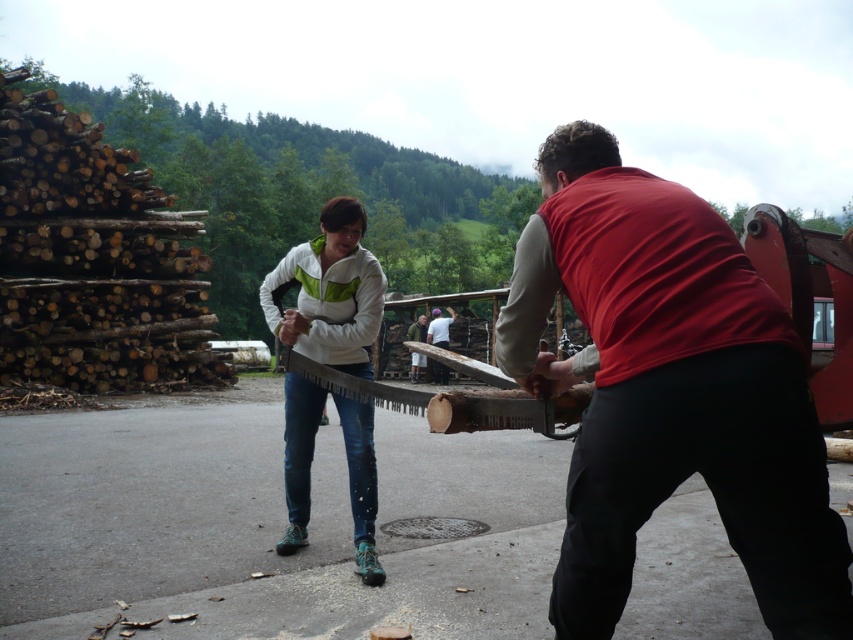
You are a photographer positioned at the origin of the coordinate system. You want to capture a closeup shot of the matte red vest at center. Given that your camera can focus on objects within a 0.1 unit radius around the point of interest, what are the coordinates you should aim for to ensure the vest is in focus?

The coordinates to aim for are approximately 0.611 on the x axis and 0.787 on the y axis, since the 2D location of the matte red vest at center is at point [670,390].

Looking at this image, you are a visitor at this outdoor workshop and want to know if the white matte jacket at center can be placed on top of the wooden saw at center without falling over. Based on their sizes, is this possible?

The white matte jacket at center is much taller than the wooden saw at center, so placing it on top might cause instability and could result in the jacket falling over.